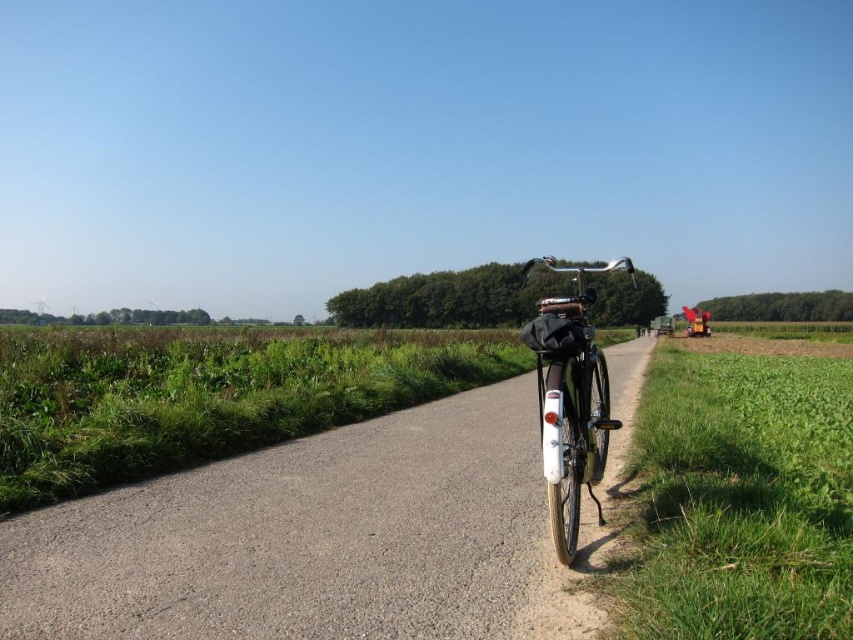
You are standing at the point labeled as point (310,540) in the image. What object are you currently standing on?

You are standing on the asphalt road at center.

You are standing on the asphalt road at center and want to place a small potted plant between yourself and the shiny metallic bicycle at center. Is this possible?

The asphalt road at center is located below the shiny metallic bicycle at center, meaning the bicycle is positioned above the road. Since you are on the road, placing the potted plant between you and the bicycle would require placing it on the road below the bicycle, which is feasible as long as there is space on the road between your current position and the bicycle.

You are standing at the center of the image. Which direction should you look to see the asphalt road at center?

The asphalt road at center is located at the center of the image, so you should look straight ahead to see it.